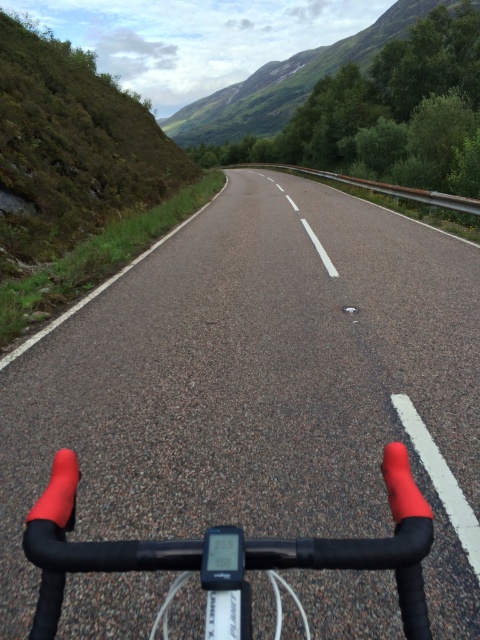
Question: Does asphalt road at center come behind rubberized matte handlebars at center?

Choices:
 (A) yes
 (B) no

Answer: (A)

Question: Which object appears closest to the camera in this image?

Choices:
 (A) rubberized matte handlebars at center
 (B) asphalt road at center

Answer: (A)

Question: Considering the relative positions of asphalt road at center and rubberized matte handlebars at center in the image provided, where is asphalt road at center located with respect to rubberized matte handlebars at center?

Choices:
 (A) left
 (B) right

Answer: (B)

Question: Is asphalt road at center positioned behind rubberized matte handlebars at center?

Choices:
 (A) yes
 (B) no

Answer: (A)